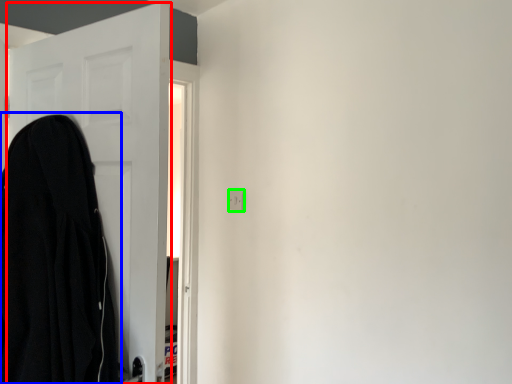
Question: Which is farther away from door (highlighted by a red box)? cloak (highlighted by a blue box) or electric outlet (highlighted by a green box)?

Choices:
 (A) cloak
 (B) electric outlet

Answer: (B)